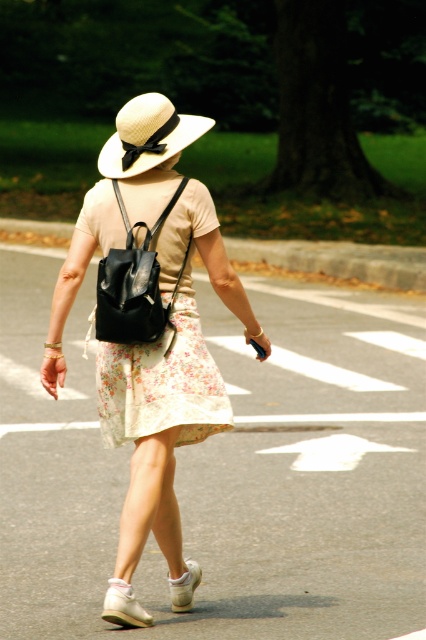
What are the coordinates of the matte black backpack at center?

The matte black backpack at center is located at coordinates point (150, 314).

You are a photographer trying to capture the person in the image. You notice the matte black backpack at center and the white fabric sandal at lower center. Which object should you focus on to ensure it appears larger in your photo?

The matte black backpack at center is taller than the white fabric sandal at lower center, so focusing on the matte black backpack at center would make it appear larger in the photo.

You are a photographer trying to capture the person in the image. If you want to focus on the matte black backpack at center while keeping the white suede sneaker at lower center in the background, is the current arrangement possible?

The matte black backpack at center is in front of the white suede sneaker at lower center, so yes, you can focus on the matte black backpack at center while having the white suede sneaker at lower center in the background as it is positioned behind.